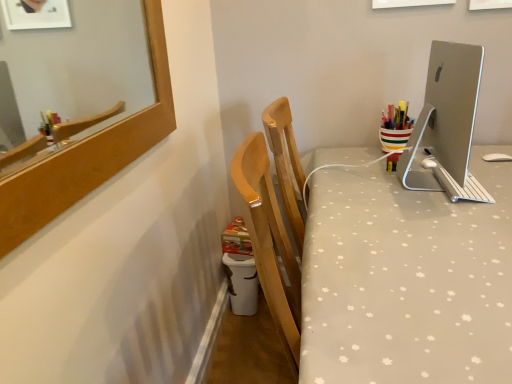
Question: Is silver metallic monitor at upper right in front of or behind white dotted fabric at center in the image?

Choices:
 (A) behind
 (B) front

Answer: (A)

Question: From the image's perspective, is silver metallic monitor at upper right located above or below white dotted fabric at center?

Choices:
 (A) above
 (B) below

Answer: (A)

Question: From their relative heights in the image, would you say silver metallic monitor at upper right is taller or shorter than white dotted fabric at center?

Choices:
 (A) short
 (B) tall

Answer: (A)

Question: Based on their positions, is white dotted fabric at center located to the left or right of silver metallic monitor at upper right?

Choices:
 (A) left
 (B) right

Answer: (B)

Question: Is white dotted fabric at center situated inside silver metallic monitor at upper right or outside?

Choices:
 (A) inside
 (B) outside

Answer: (B)

Question: Is point (451, 281) closer or farther from the camera than point (409, 150)?

Choices:
 (A) farther
 (B) closer

Answer: (B)

Question: Looking at their shapes, would you say white dotted fabric at center is wider or thinner than silver metallic monitor at upper right?

Choices:
 (A) thin
 (B) wide

Answer: (B)